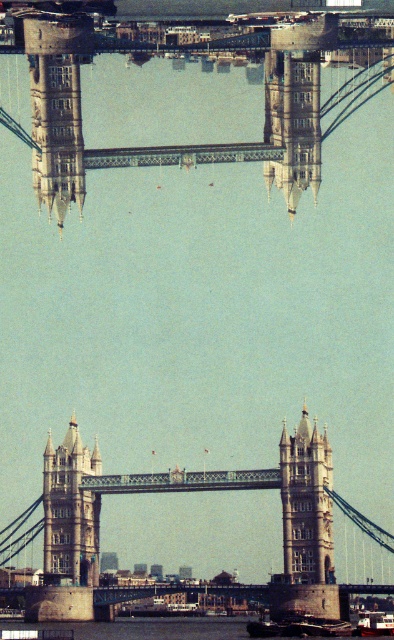
Which is in front, point (200, 156) or point (289, 538)?

Point (200, 156) is more forward.

Does stone gray suspension bridge at upper center appear on the left side of stone tower at center?

Yes, stone gray suspension bridge at upper center is to the left of stone tower at center.

Does point (299, 131) come farther from viewer compared to point (304, 589)?

No, it is not.

Where is `stone gray suspension bridge at upper center`? The height and width of the screenshot is (640, 394). stone gray suspension bridge at upper center is located at coordinates (193, 60).

Looking at this image, does stone gray suspension bridge at upper center have a lesser height compared to white plastic boat at center?

No.

Is stone gray suspension bridge at upper center positioned behind white plastic boat at center?

No, stone gray suspension bridge at upper center is in front of white plastic boat at center.

This screenshot has width=394, height=640. What do you see at coordinates (193, 60) in the screenshot?
I see `stone gray suspension bridge at upper center` at bounding box center [193, 60].

Identify the location of stone gray suspension bridge at upper center. The width and height of the screenshot is (394, 640). (193, 60).

Is stone stone bridge at center positioned at the back of golden stone tower at center?

That is False.

The width and height of the screenshot is (394, 640). I want to click on stone stone bridge at center, so click(x=191, y=490).

Identify the location of stone stone bridge at center. (191, 490).